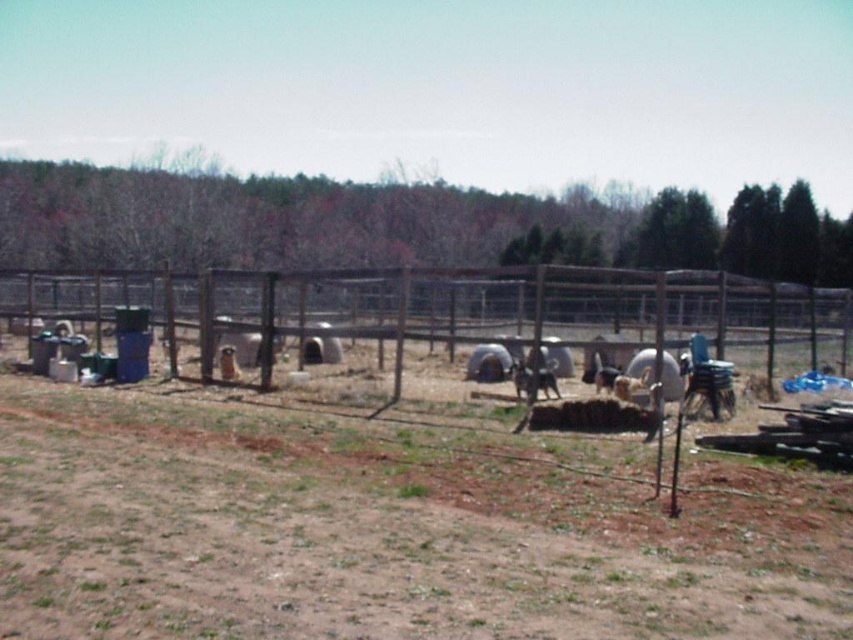
Question: Is brown dirt field at lower center above brown wire fence at center?

Choices:
 (A) no
 (B) yes

Answer: (A)

Question: Which of the following is the closest to the observer?

Choices:
 (A) brown dirt field at lower center
 (B) brown wire fence at center

Answer: (A)

Question: Does brown dirt field at lower center appear over brown wire fence at center?

Choices:
 (A) yes
 (B) no

Answer: (B)

Question: Does brown dirt field at lower center come in front of brown wire fence at center?

Choices:
 (A) yes
 (B) no

Answer: (A)